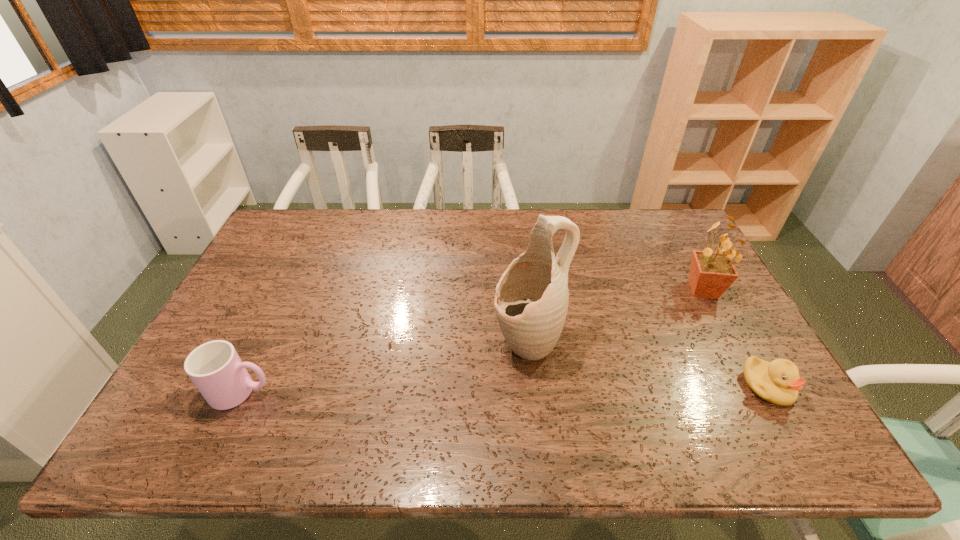
Locate an element on the screen. This screenshot has height=540, width=960. the leftmost object is located at coordinates (215, 368).

In order to click on cup in this screenshot , I will do `click(215, 368)`.

This screenshot has width=960, height=540. In order to click on duckling in this screenshot , I will do `click(778, 382)`.

Image resolution: width=960 pixels, height=540 pixels. I want to click on sunflower, so click(711, 273).

I want to click on the second tallest object, so click(x=711, y=273).

Identify the location of the second object from left to right. (531, 301).

This screenshot has height=540, width=960. What are the coordinates of `the tallest object` in the screenshot? It's located at (531, 301).

Where is `vacant space located 0.330m with the handle on the side of the third tallest object`? vacant space located 0.330m with the handle on the side of the third tallest object is located at coordinates (409, 392).

This screenshot has width=960, height=540. In order to click on free spot located at the front of the third shortest object with flowers visible in this screenshot , I will do `click(617, 353)`.

Find the location of a particular element. This screenshot has width=960, height=540. free space located 0.060m at the front of the third shortest object with flowers visible is located at coordinates click(x=680, y=308).